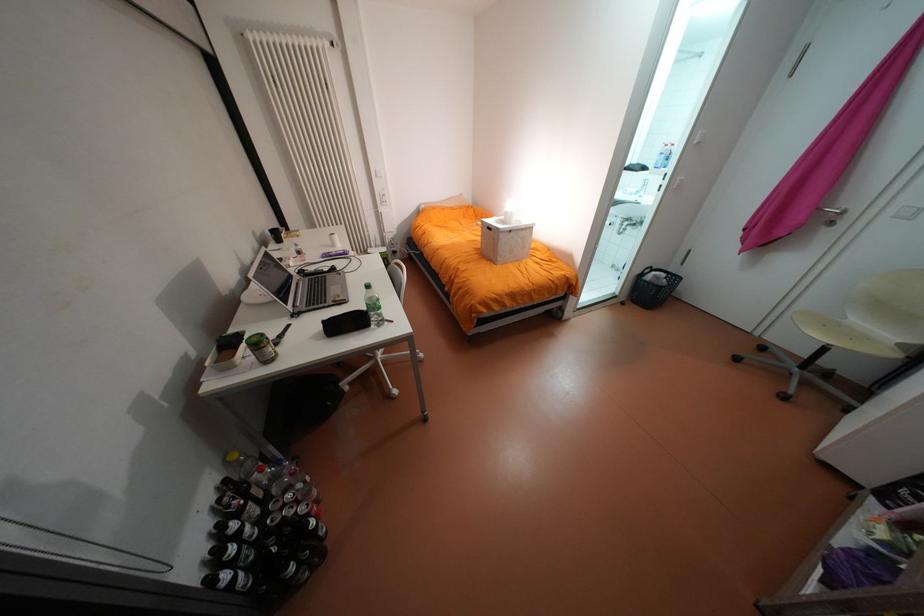
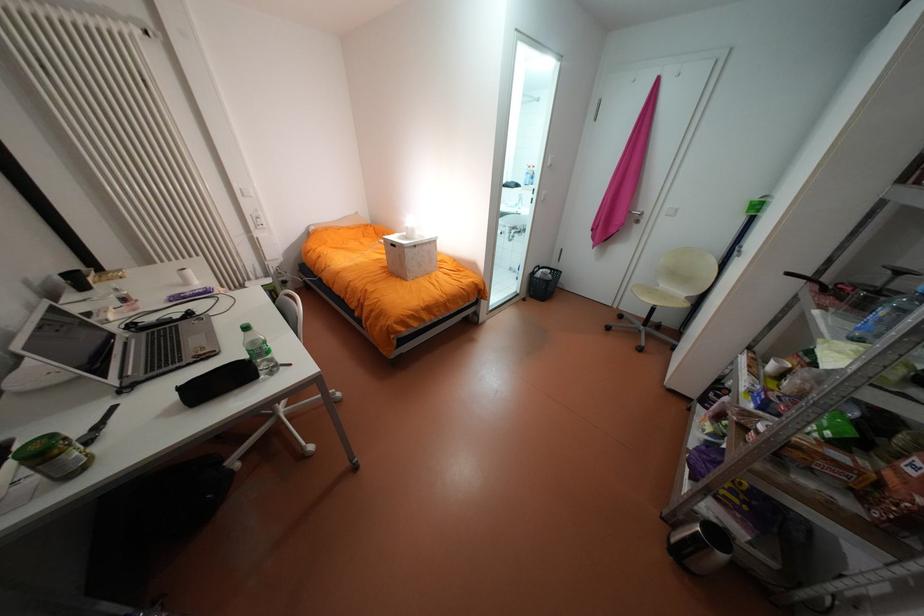
Which direction would the cameraman need to move to produce the second image?

The cameraman walked toward right, forward.